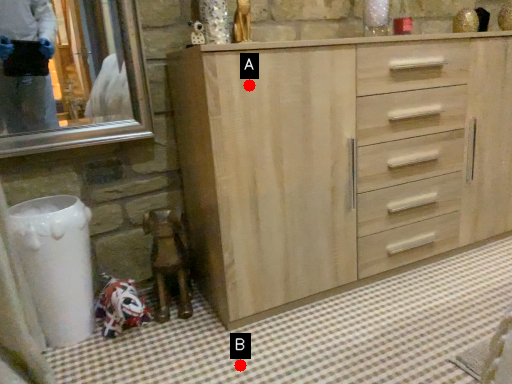
Question: Two points are circled on the image, labeled by A and B beside each circle. Which point is farther to the camera?

Choices:
 (A) A is further
 (B) B is further

Answer: (B)